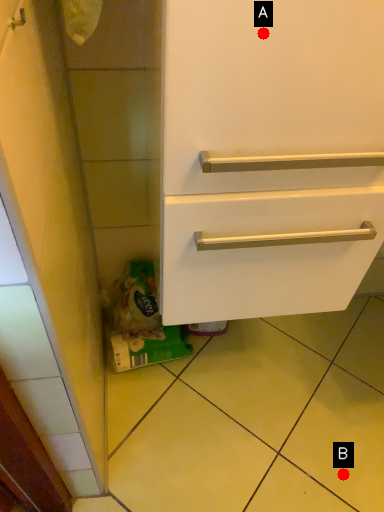
Question: Two points are circled on the image, labeled by A and B beside each circle. Which point is closer to the camera taking this photo?

Choices:
 (A) A is closer
 (B) B is closer

Answer: (A)